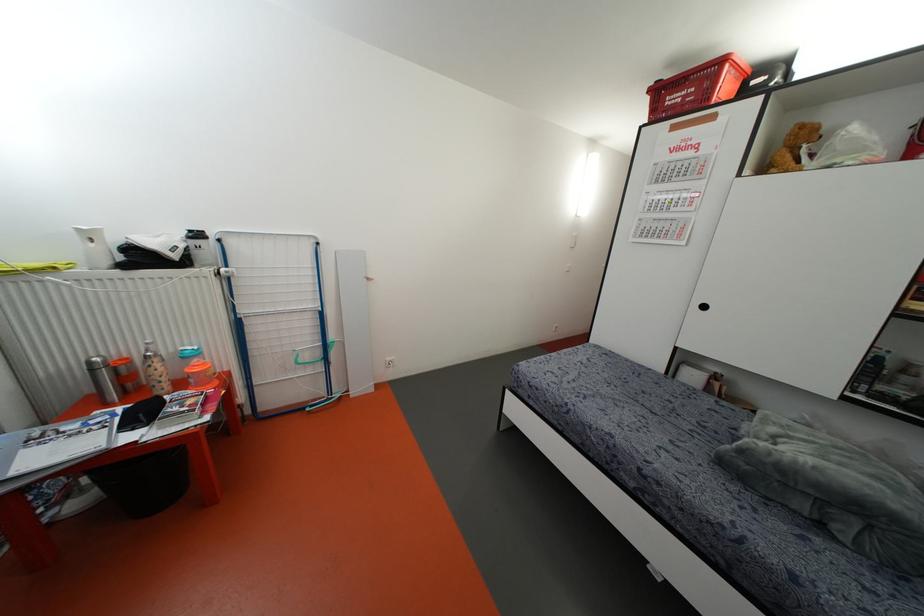
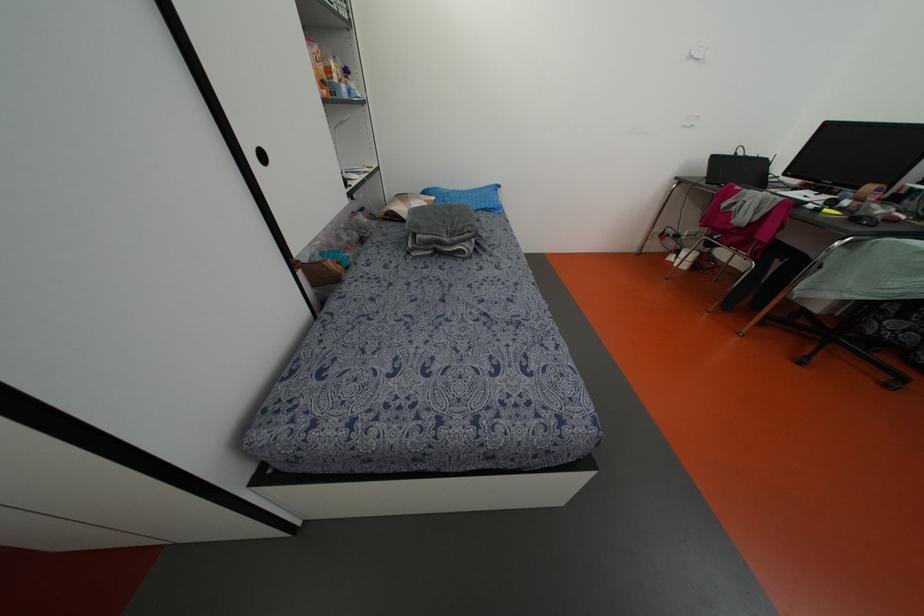
In the second image, find the point that corresponds to point (703, 307) in the first image.

(262, 156)